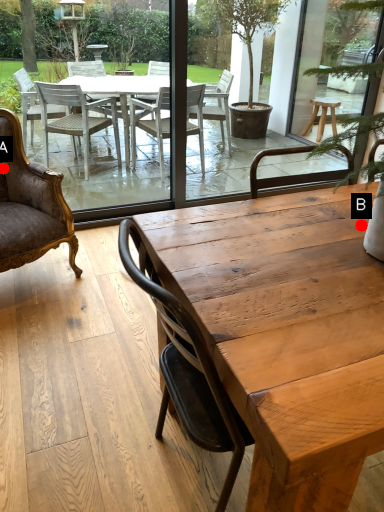
Question: Two points are circled on the image, labeled by A and B beside each circle. Which point is closer to the camera?

Choices:
 (A) A is closer
 (B) B is closer

Answer: (B)